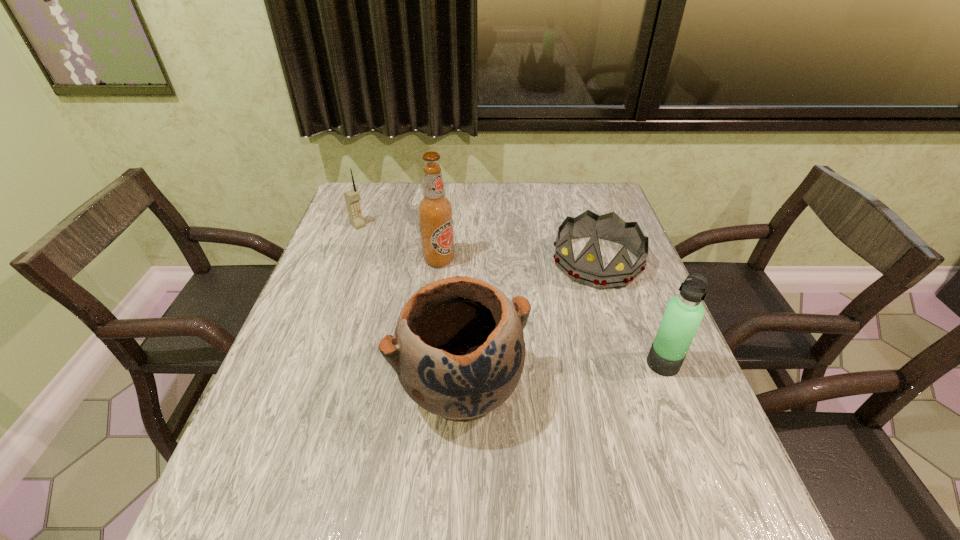
Locate an element on the screen. Image resolution: width=960 pixels, height=540 pixels. vacant space on the desktop that is between the pottery and the thermos bottle and is positioned on the front label of the tallest object is located at coordinates (557, 376).

The width and height of the screenshot is (960, 540). I want to click on vacant spot on the desktop that is between the pottery and the thermos bottle and is positioned on the front of the farthest object, where the keypad is located, so click(x=538, y=378).

At what (x,y) coordinates should I click in order to perform the action: click on vacant space on the desktop that is between the pottery and the thermos bottle and is positioned at the front of the tiara with jewels. Please return your answer as a coordinate pair (x, y). The width and height of the screenshot is (960, 540). Looking at the image, I should click on (541, 377).